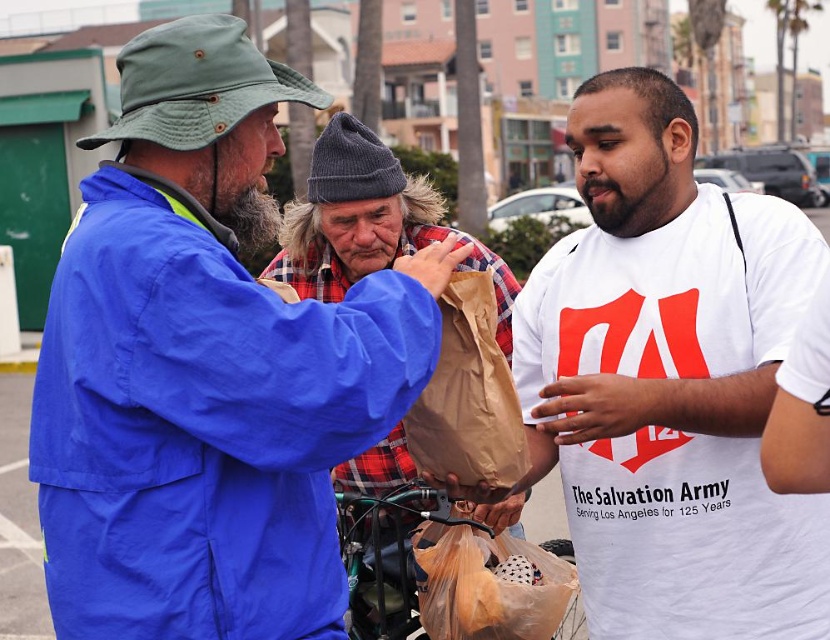
You are standing in front of the scene and want to determine which of the two points, point (265,451) or point (420,547), is closer to you. Based on the image, which point is nearer?

Point (265,451) is closer to the camera than point (420,547), so it is nearer to you.